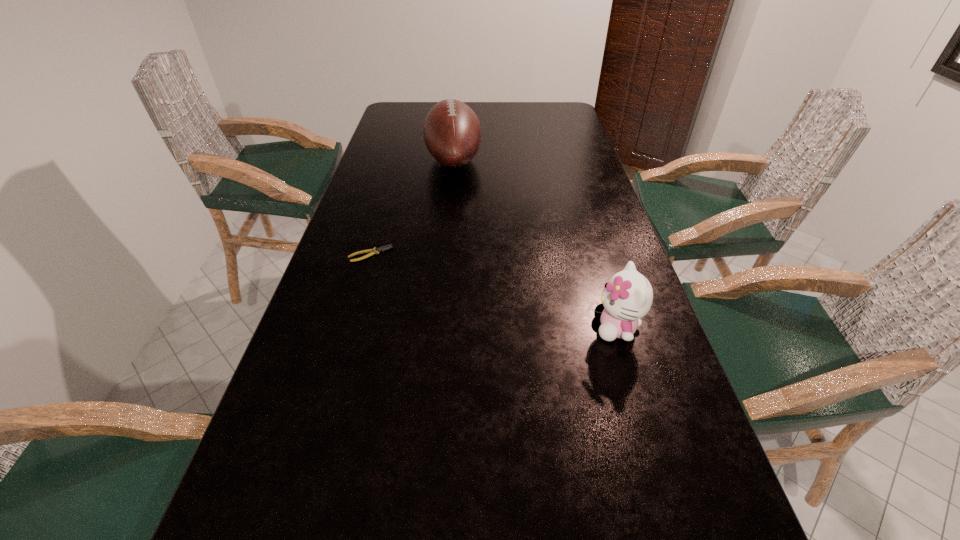
Image resolution: width=960 pixels, height=540 pixels. Identify the location of free space that is in between the football (American) and the pliers. (412, 207).

Where is `vacant space that is in between the pliers and the farthest object`? vacant space that is in between the pliers and the farthest object is located at coordinates (412, 207).

The image size is (960, 540). Identify the location of vacant space in between the football (American) and the nearest object. (535, 244).

Where is `vacant space that's between the farthest object and the nearest object`? The height and width of the screenshot is (540, 960). vacant space that's between the farthest object and the nearest object is located at coordinates (535, 244).

This screenshot has height=540, width=960. In order to click on free spot between the rightmost object and the second object from right to left in this screenshot , I will do `click(535, 244)`.

This screenshot has width=960, height=540. Identify the location of free space that is in between the football (American) and the kitten. (535, 244).

Image resolution: width=960 pixels, height=540 pixels. Identify the location of free space between the second farthest object and the tallest object. (412, 207).

Image resolution: width=960 pixels, height=540 pixels. Find the location of `free space between the second tallest object and the second object from right to left`. free space between the second tallest object and the second object from right to left is located at coordinates (535, 244).

The height and width of the screenshot is (540, 960). What are the coordinates of `the closest object to the second object from left to right` in the screenshot? It's located at coord(375,250).

Locate which object ranks in proximity to the football (American). Please provide its 2D coordinates. Your answer should be formatted as a tuple, i.e. [(x, y)], where the tuple contains the x and y coordinates of a point satisfying the conditions above.

[(375, 250)]